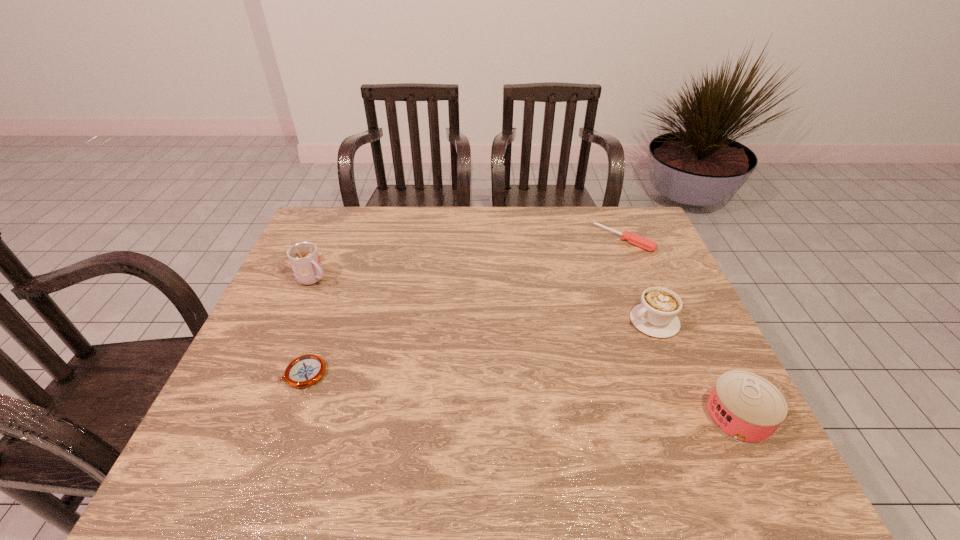
At what (x,y) coordinates should I click in order to perform the action: click on object located in the near edge section of the desktop. Please return your answer as a coordinate pair (x, y). Looking at the image, I should click on (747, 408).

Find the location of a particular element. This screenshot has height=540, width=960. compass located at the left edge is located at coordinates (304, 371).

The height and width of the screenshot is (540, 960). Identify the location of cup that is at the left edge. (304, 258).

You are a GUI agent. You are given a task and a screenshot of the screen. Output one action in this format:
    pyautogui.click(x=<x>, y=<y>)
    Task: Click on the can present at the right edge
    The width and height of the screenshot is (960, 540).
    Given the screenshot: What is the action you would take?
    pyautogui.click(x=747, y=408)

The height and width of the screenshot is (540, 960). I want to click on cappuccino at the right edge, so click(x=656, y=316).

The height and width of the screenshot is (540, 960). I want to click on screwdriver positioned at the right edge, so click(x=644, y=243).

This screenshot has height=540, width=960. I want to click on object situated at the far right corner, so click(x=644, y=243).

You are a GUI agent. You are given a task and a screenshot of the screen. Output one action in this format:
    pyautogui.click(x=<x>, y=<y>)
    Task: Click on the object that is at the near right corner
    
    Given the screenshot: What is the action you would take?
    pyautogui.click(x=747, y=408)

In order to click on free space at the far edge of the desktop in this screenshot , I will do `click(380, 230)`.

Locate an element on the screen. blank space at the near edge of the desktop is located at coordinates (321, 411).